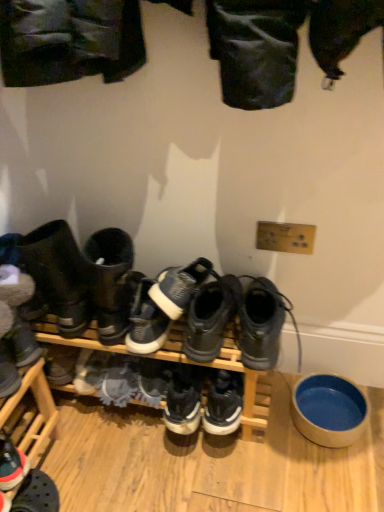
At what (x,y) coordinates should I click in order to perform the action: click on free space in front of blue ceramic bowl at lower right. Please return your answer as a coordinate pair (x, y). The width and height of the screenshot is (384, 512). Looking at the image, I should click on (333, 478).